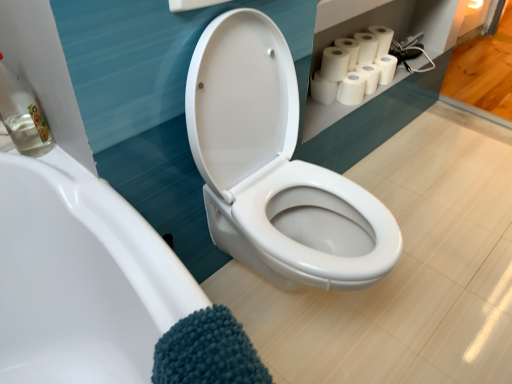
What do you see at coordinates (386, 68) in the screenshot? This screenshot has height=384, width=512. I see `white matte toilet paper at upper right, the 7th toilet paper viewed from the left` at bounding box center [386, 68].

Describe the element at coordinates (366, 47) in the screenshot. Image resolution: width=512 pixels, height=384 pixels. I see `white matte toilet paper at upper right, marked as the fourth toilet paper in a right-to-left arrangement` at that location.

This screenshot has width=512, height=384. Identify the location of white matte paper towel at upper right. pyautogui.click(x=351, y=89).

This screenshot has height=384, width=512. What do you see at coordinates (349, 50) in the screenshot?
I see `white matte toilet paper at upper right, placed as the third toilet paper when sorted from left to right` at bounding box center [349, 50].

Locate an element on the screen. Image resolution: width=512 pixels, height=384 pixels. white matte toilet paper at upper right, which is the 1th toilet paper from right to left is located at coordinates (386, 68).

Which is correct: white matte toilet paper at upper right, the 7th toilet paper viewed from the left, is inside clear glass bottle at left, or outside of it?

white matte toilet paper at upper right, the 7th toilet paper viewed from the left, is not enclosed by clear glass bottle at left.

In the scene shown: Which object is wider, white matte toilet paper at upper right, which is the 1th toilet paper from right to left, or clear glass bottle at left?

white matte toilet paper at upper right, which is the 1th toilet paper from right to left, is wider.

Which is closer, (389,72) or (11,124)?

Point (389,72) is positioned farther from the camera compared to point (11,124).

Does white matte toilet paper at upper right, which is the 1th toilet paper from right to left, have a lesser height compared to clear glass bottle at left?

Yes, white matte toilet paper at upper right, which is the 1th toilet paper from right to left, is shorter than clear glass bottle at left.

Between white matte paper towel at upper right and white matte toilet paper at upper right, placed as the 7th toilet paper when sorted from right to left, which one has larger width?

With larger width is white matte toilet paper at upper right, placed as the 7th toilet paper when sorted from right to left.

From the image's perspective, does white matte paper towel at upper right appear lower than white matte toilet paper at upper right, placed as the 7th toilet paper when sorted from right to left?

Actually, white matte paper towel at upper right appears above white matte toilet paper at upper right, placed as the 7th toilet paper when sorted from right to left, in the image.

Could you tell me if white matte paper towel at upper right is facing white matte toilet paper at upper right, placed as the 7th toilet paper when sorted from right to left?

No.

Does white matte toilet paper at upper right, placed as the 7th toilet paper when sorted from right to left, appear on the left side of white matte paper towel at upper right?

Yes.

Considering the relative sizes of white matte toilet paper at upper right, placed as the 7th toilet paper when sorted from right to left, and white matte paper towel at upper right in the image provided, is white matte toilet paper at upper right, placed as the 7th toilet paper when sorted from right to left, smaller than white matte paper towel at upper right?

Indeed, white matte toilet paper at upper right, placed as the 7th toilet paper when sorted from right to left, has a smaller size compared to white matte paper towel at upper right.

Does white matte toilet paper at upper right, placed as the 7th toilet paper when sorted from right to left, have a greater width compared to white matte paper towel at upper right?

Correct, the width of white matte toilet paper at upper right, placed as the 7th toilet paper when sorted from right to left, exceeds that of white matte paper towel at upper right.

Considering their positions, is white matte toilet paper at upper right, placed as the 7th toilet paper when sorted from right to left, located in front of or behind white matte paper towel at upper right?

In the image, white matte toilet paper at upper right, placed as the 7th toilet paper when sorted from right to left, appears behind white matte paper towel at upper right.

Is clear glass bottle at left shorter than white matte toilet paper at upper right, which is the fourth toilet paper from left to right?

Incorrect, the height of clear glass bottle at left does not fall short of that of white matte toilet paper at upper right, which is the fourth toilet paper from left to right.

Which of these two, clear glass bottle at left or white matte toilet paper at upper right, marked as the fourth toilet paper in a right-to-left arrangement, is smaller?

With smaller size is white matte toilet paper at upper right, marked as the fourth toilet paper in a right-to-left arrangement.

From the image's perspective, which one is positioned lower, clear glass bottle at left or white matte toilet paper at upper right, which is the fourth toilet paper from left to right?

clear glass bottle at left.

At what (x,y) coordinates should I click in order to perform the action: click on bottle that appears in front of the white matte toilet paper at upper right, which is the fourth toilet paper from left to right. Please return your answer as a coordinate pair (x, y). Looking at the image, I should click on (22, 114).

Could you tell me if white matte toilet paper at upper right, marked as the 6th toilet paper in a left-to-right arrangement, is turned towards white matte toilet paper at upper right, the 3th toilet paper when ordered from right to left?

No, white matte toilet paper at upper right, marked as the 6th toilet paper in a left-to-right arrangement, is not oriented towards white matte toilet paper at upper right, the 3th toilet paper when ordered from right to left.

Consider the image. Can you confirm if white matte toilet paper at upper right, marked as the second toilet paper in a right-to-left arrangement, is smaller than white matte toilet paper at upper right, the fifth toilet paper in the left-to-right sequence?

Actually, white matte toilet paper at upper right, marked as the second toilet paper in a right-to-left arrangement, might be larger than white matte toilet paper at upper right, the fifth toilet paper in the left-to-right sequence.

Considering their positions, is white matte toilet paper at upper right, marked as the second toilet paper in a right-to-left arrangement, located in front of or behind white matte toilet paper at upper right, the 3th toilet paper when ordered from right to left?

white matte toilet paper at upper right, marked as the second toilet paper in a right-to-left arrangement, is behind white matte toilet paper at upper right, the 3th toilet paper when ordered from right to left.

Which object is wider, white matte toilet paper at upper right, marked as the second toilet paper in a right-to-left arrangement, or white matte toilet paper at upper right, the 7th toilet paper viewed from the left?

white matte toilet paper at upper right, marked as the second toilet paper in a right-to-left arrangement, is wider.

Are white matte toilet paper at upper right, marked as the 6th toilet paper in a left-to-right arrangement, and white matte toilet paper at upper right, the 7th toilet paper viewed from the left, located far from each other?

white matte toilet paper at upper right, marked as the 6th toilet paper in a left-to-right arrangement, is actually quite close to white matte toilet paper at upper right, the 7th toilet paper viewed from the left.

Considering the relative positions of white matte toilet paper at upper right, marked as the 6th toilet paper in a left-to-right arrangement, and white matte toilet paper at upper right, which is the 1th toilet paper from right to left, in the image provided, is white matte toilet paper at upper right, marked as the 6th toilet paper in a left-to-right arrangement, to the right of white matte toilet paper at upper right, which is the 1th toilet paper from right to left, from the viewer's perspective?

No.

Is point (388, 52) closer or farther from the camera than point (346, 42)?

Point (388, 52).

In the scene shown: Considering the sizes of white matte toilet paper at upper right, marked as the 6th toilet paper in a left-to-right arrangement, and white matte toilet paper at upper right, the 5th toilet paper in the right-to-left sequence, in the image, is white matte toilet paper at upper right, marked as the 6th toilet paper in a left-to-right arrangement, bigger or smaller than white matte toilet paper at upper right, the 5th toilet paper in the right-to-left sequence,?

Considering their sizes, white matte toilet paper at upper right, marked as the 6th toilet paper in a left-to-right arrangement, takes up less space than white matte toilet paper at upper right, the 5th toilet paper in the right-to-left sequence.

Is white matte toilet paper at upper right, marked as the 6th toilet paper in a left-to-right arrangement, looking in the opposite direction of white matte toilet paper at upper right, the 5th toilet paper in the right-to-left sequence?

No, white matte toilet paper at upper right, marked as the 6th toilet paper in a left-to-right arrangement, is not facing away from white matte toilet paper at upper right, the 5th toilet paper in the right-to-left sequence.

Considering the relative positions of white matte toilet paper at upper right, marked as the 6th toilet paper in a left-to-right arrangement, and white matte toilet paper at upper right, placed as the third toilet paper when sorted from left to right, in the image provided, is white matte toilet paper at upper right, marked as the 6th toilet paper in a left-to-right arrangement, to the left of white matte toilet paper at upper right, placed as the third toilet paper when sorted from left to right, from the viewer's perspective?

In fact, white matte toilet paper at upper right, marked as the 6th toilet paper in a left-to-right arrangement, is to the right of white matte toilet paper at upper right, placed as the third toilet paper when sorted from left to right.

Find the location of `bottle above the white matte toilet paper at upper right, the 7th toilet paper viewed from the left (from a real-world perspective)`. bottle above the white matte toilet paper at upper right, the 7th toilet paper viewed from the left (from a real-world perspective) is located at coordinates (22, 114).

Identify the location of paper towel located above the white matte toilet paper at upper right, placed as the 7th toilet paper when sorted from right to left (from the image's perspective). The image size is (512, 384). (351, 89).

Looking at the image, which one is located closer to white matte toilet paper at upper right, marked as the 6th toilet paper in a left-to-right arrangement, white matte toilet paper at upper right, the fifth toilet paper in the left-to-right sequence, or white matte toilet paper at upper right, placed as the third toilet paper when sorted from left to right?

white matte toilet paper at upper right, the fifth toilet paper in the left-to-right sequence, is closer to white matte toilet paper at upper right, marked as the 6th toilet paper in a left-to-right arrangement.

From the picture: Based on their spatial positions, is clear glass bottle at left or white matte toilet paper at upper right, positioned as the sixth toilet paper in right-to-left order, closer to white matte toilet paper at upper right, the 5th toilet paper in the right-to-left sequence?

white matte toilet paper at upper right, positioned as the sixth toilet paper in right-to-left order.

From the image, which object appears to be farther from white matte toilet paper at upper right, which is the 2th toilet paper from left to right, white matte toilet paper at upper right, the first toilet paper viewed from the left, or white matte toilet paper at upper right, marked as the fourth toilet paper in a right-to-left arrangement?

white matte toilet paper at upper right, marked as the fourth toilet paper in a right-to-left arrangement, is further to white matte toilet paper at upper right, which is the 2th toilet paper from left to right.

Which object lies nearer to the anchor point white matte toilet paper at upper right, which is the fourth toilet paper from left to right, clear glass bottle at left or white matte toilet paper at upper right, placed as the third toilet paper when sorted from left to right?

white matte toilet paper at upper right, placed as the third toilet paper when sorted from left to right.

When comparing their distances from white matte paper towel at upper right, does white matte toilet paper at upper right, the 5th toilet paper in the right-to-left sequence, or clear glass bottle at left seem further?

clear glass bottle at left is further to white matte paper towel at upper right.

From the image, which object appears to be nearer to white matte toilet paper at upper right, the fifth toilet paper in the left-to-right sequence, white matte toilet paper at upper right, placed as the 7th toilet paper when sorted from right to left, or white matte paper towel at upper right?

The object closer to white matte toilet paper at upper right, the fifth toilet paper in the left-to-right sequence, is white matte paper towel at upper right.

Estimate the real-world distances between objects in this image. Which object is further from clear glass bottle at left, white matte toilet paper at upper right, marked as the second toilet paper in a right-to-left arrangement, or white matte toilet paper at upper right, placed as the third toilet paper when sorted from left to right?

Based on the image, white matte toilet paper at upper right, marked as the second toilet paper in a right-to-left arrangement, appears to be further to clear glass bottle at left.

Looking at the image, which one is located closer to white matte toilet paper at upper right, marked as the second toilet paper in a right-to-left arrangement, white matte toilet paper at upper right, placed as the 7th toilet paper when sorted from right to left, or white matte toilet paper at upper right, positioned as the sixth toilet paper in right-to-left order?

white matte toilet paper at upper right, positioned as the sixth toilet paper in right-to-left order, is closer to white matte toilet paper at upper right, marked as the second toilet paper in a right-to-left arrangement.

Image resolution: width=512 pixels, height=384 pixels. Identify the location of paper towel between white matte toilet paper at upper right, marked as the 6th toilet paper in a left-to-right arrangement, and white matte toilet paper at upper right, placed as the 7th toilet paper when sorted from right to left, from top to bottom. (351, 89).

What are the coordinates of `toilet paper between white matte toilet paper at upper right, which is the 2th toilet paper from left to right, and white matte toilet paper at upper right, which is the fourth toilet paper from left to right, in the horizontal direction` in the screenshot? It's located at (x=349, y=50).

Where is `paper towel between white matte toilet paper at upper right, placed as the 7th toilet paper when sorted from right to left, and white matte toilet paper at upper right, the fifth toilet paper in the left-to-right sequence, in the horizontal direction`? The height and width of the screenshot is (384, 512). paper towel between white matte toilet paper at upper right, placed as the 7th toilet paper when sorted from right to left, and white matte toilet paper at upper right, the fifth toilet paper in the left-to-right sequence, in the horizontal direction is located at coordinates (351, 89).

Identify the location of paper towel situated between white matte toilet paper at upper right, placed as the 7th toilet paper when sorted from right to left, and white matte toilet paper at upper right, which is the 1th toilet paper from right to left, from left to right. (351, 89).